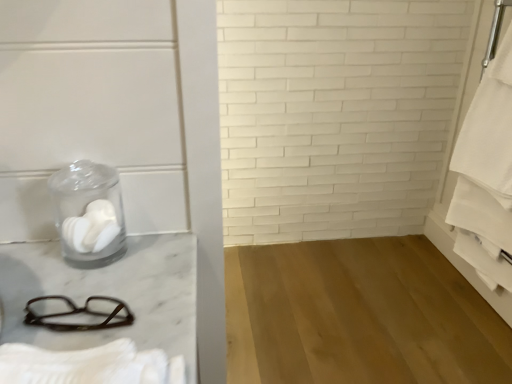
Question: Is white cotton bath towel at right, which is counted as the second bath towel, starting from the bottom, shorter than white matte toilet paper at left?

Choices:
 (A) no
 (B) yes

Answer: (A)

Question: Are white cotton bath towel at right, which is counted as the first bath towel, starting from the top, and white matte toilet paper at left far apart?

Choices:
 (A) yes
 (B) no

Answer: (A)

Question: From a real-world perspective, is white cotton bath towel at right, which is counted as the second bath towel, starting from the bottom, physically above white matte toilet paper at left?

Choices:
 (A) yes
 (B) no

Answer: (B)

Question: Considering the relative sizes of white cotton bath towel at right, which is counted as the first bath towel, starting from the top, and white matte toilet paper at left in the image provided, is white cotton bath towel at right, which is counted as the first bath towel, starting from the top, wider than white matte toilet paper at left?

Choices:
 (A) yes
 (B) no

Answer: (A)

Question: From a real-world perspective, is white cotton bath towel at right, the first bath towel from the back, below white matte toilet paper at left?

Choices:
 (A) yes
 (B) no

Answer: (A)

Question: From the image's perspective, is white cotton bath towel at right, which is counted as the first bath towel, starting from the top, positioned above or below brown plastic glasses at lower left?

Choices:
 (A) above
 (B) below

Answer: (A)

Question: Looking at their shapes, would you say white cotton bath towel at right, the first bath towel from the back, is wider or thinner than brown plastic glasses at lower left?

Choices:
 (A) thin
 (B) wide

Answer: (B)

Question: In terms of height, does white cotton bath towel at right, which is counted as the second bath towel, starting from the bottom, look taller or shorter compared to brown plastic glasses at lower left?

Choices:
 (A) tall
 (B) short

Answer: (A)

Question: Is point (495, 67) positioned closer to the camera than point (53, 317)?

Choices:
 (A) closer
 (B) farther

Answer: (B)

Question: Is brown plastic glasses at lower left taller or shorter than white cotton bath towel at right, which is counted as the first bath towel, starting from the top?

Choices:
 (A) tall
 (B) short

Answer: (B)

Question: In the image, is brown plastic glasses at lower left positioned in front of or behind white cotton bath towel at right, which is counted as the first bath towel, starting from the top?

Choices:
 (A) front
 (B) behind

Answer: (A)

Question: Is brown plastic glasses at lower left inside the boundaries of white cotton bath towel at right, the second bath towel viewed from the left, or outside?

Choices:
 (A) inside
 (B) outside

Answer: (B)

Question: Is point (96, 327) positioned closer to the camera than point (489, 67)?

Choices:
 (A) farther
 (B) closer

Answer: (B)

Question: In the image, is white cotton bath towel at lower left, the 1th bath towel positioned from the front, on the left side or the right side of transparent glass jar at left?

Choices:
 (A) right
 (B) left

Answer: (A)

Question: Which is correct: white cotton bath towel at lower left, acting as the second bath towel starting from the right, is inside transparent glass jar at left, or outside of it?

Choices:
 (A) outside
 (B) inside

Answer: (A)